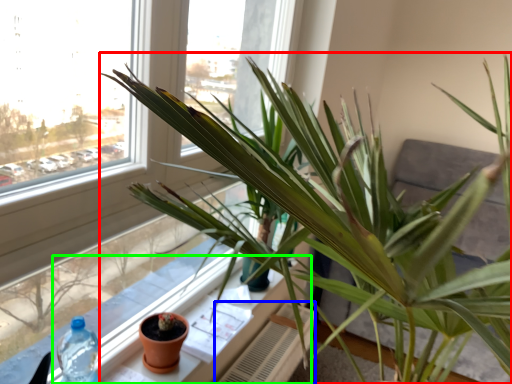
Question: Which is nearer to the houseplant (highlighted by a red box)? radiator (highlighted by a blue box) or window sill (highlighted by a green box).

Choices:
 (A) radiator
 (B) window sill

Answer: (B)